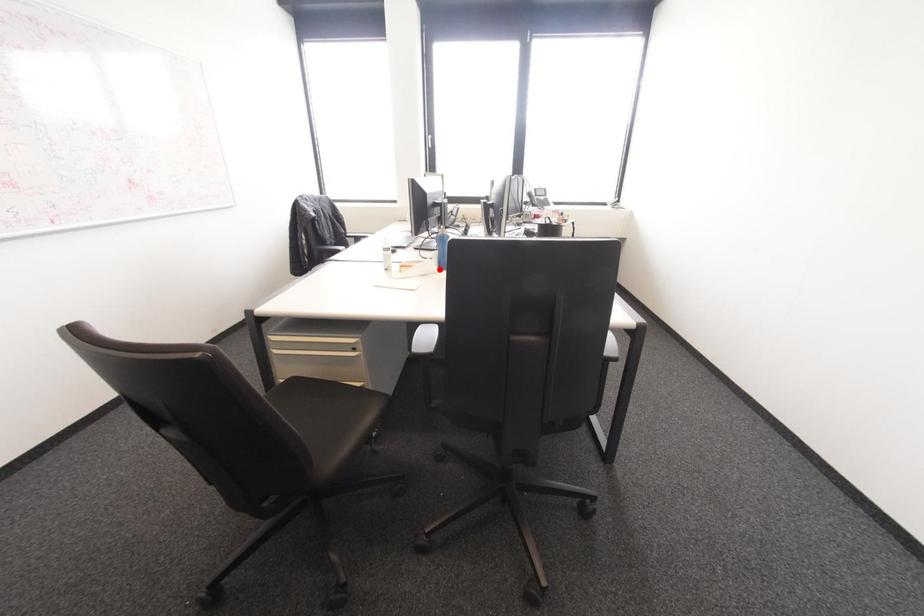
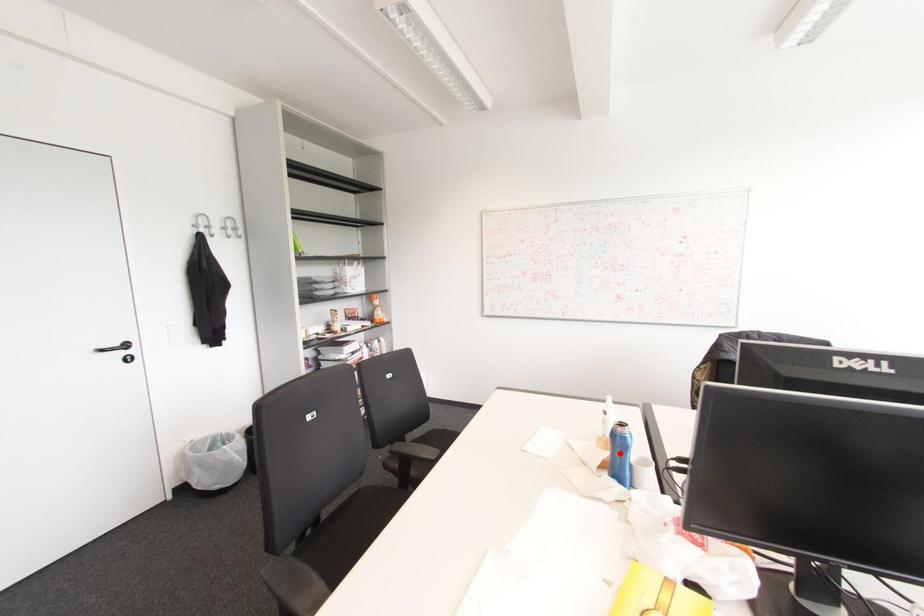
I am providing you with two images of the same scene from different viewpoints. A red point is marked on the first image and another point is marked on the second image. Do the highlighted points in image1 and image2 indicate the same real-world spot?

No